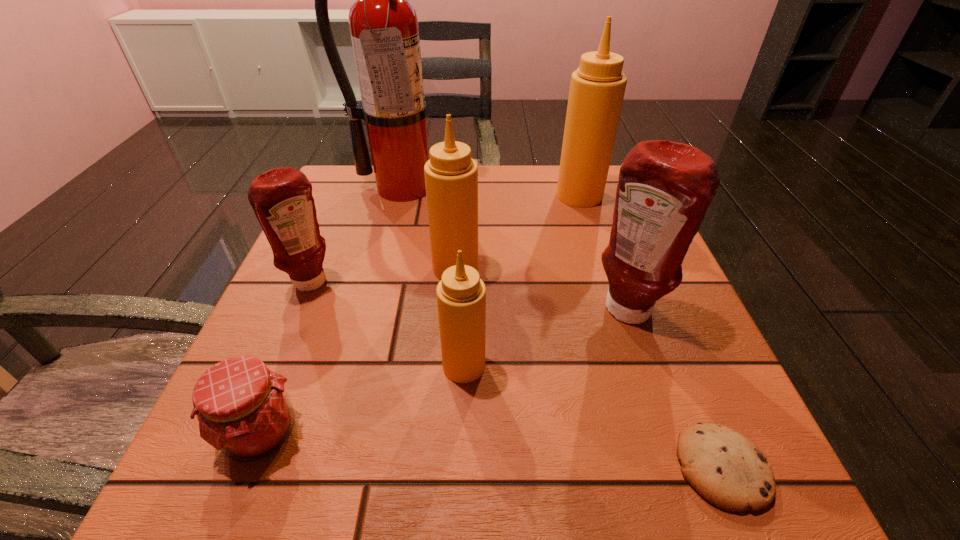
Where is `object that is at the near left corner`? The image size is (960, 540). object that is at the near left corner is located at coordinates tap(243, 409).

I want to click on object located in the far right corner section of the desktop, so click(x=597, y=88).

Locate an element on the screen. The height and width of the screenshot is (540, 960). object located at the near right corner is located at coordinates (727, 469).

You are a GUI agent. You are given a task and a screenshot of the screen. Output one action in this format:
    pyautogui.click(x=<x>, y=<y>)
    Task: Click on the free space at the far edge of the desktop
    The width and height of the screenshot is (960, 540).
    Given the screenshot: What is the action you would take?
    pyautogui.click(x=535, y=217)

The width and height of the screenshot is (960, 540). I want to click on free space at the near edge, so click(x=336, y=496).

In the image, there is a desktop. Identify the location of vacant space at the left edge. This screenshot has width=960, height=540. (327, 312).

Find the location of `vacant space at the right edge`. vacant space at the right edge is located at coordinates (751, 432).

At what (x,y) coordinates should I click in order to perform the action: click on free point at the far left corner. Please return your answer as a coordinate pair (x, y). Looking at the image, I should click on (350, 190).

The height and width of the screenshot is (540, 960). I want to click on empty location between the red fire extinguisher and the smaller red condiment, so tap(358, 235).

Locate an element on the screen. This screenshot has width=960, height=540. empty space that is in between the shortest object and the second nearest tan condiment is located at coordinates (588, 368).